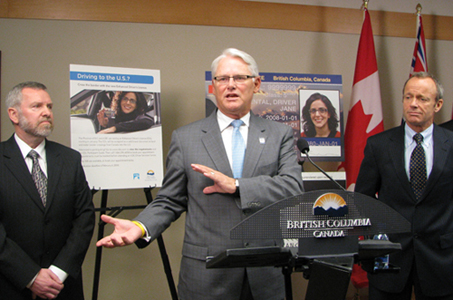
At what (x,y) coordinates should I click in order to perform the action: click on poster. Please return your answer as a coordinate pair (x, y). Looking at the image, I should click on (138, 147), (309, 110).